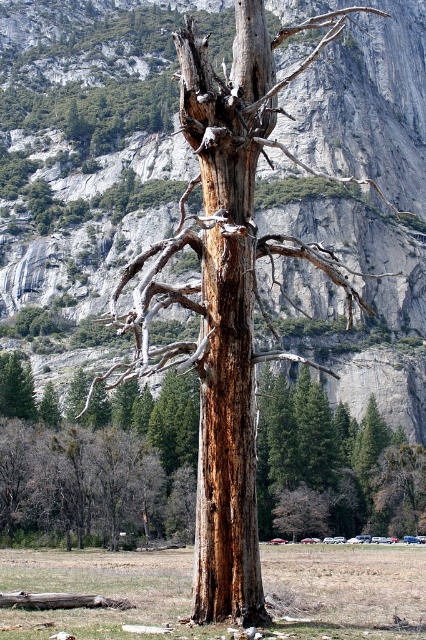
Question: Which of the following is the farthest from the observer?

Choices:
 (A) (371, 618)
 (B) (199, 595)
 (C) (58, 214)

Answer: (C)

Question: Which object appears closest to the camera in this image?

Choices:
 (A) brown grass at center
 (B) brown rough bark tree trunk at center
 (C) rusty wood tree trunk at center

Answer: (A)

Question: Among these objects, which one is farthest from the camera?

Choices:
 (A) brown rough bark tree trunk at center
 (B) rusty wood tree trunk at center

Answer: (B)

Question: Is rusty wood tree trunk at center further to camera compared to brown grass at center?

Choices:
 (A) yes
 (B) no

Answer: (A)

Question: Does rugged stone mountain at center appear on the right side of brown grass at center?

Choices:
 (A) no
 (B) yes

Answer: (B)

Question: Is rugged stone mountain at center in front of rusty wood tree trunk at center?

Choices:
 (A) no
 (B) yes

Answer: (A)